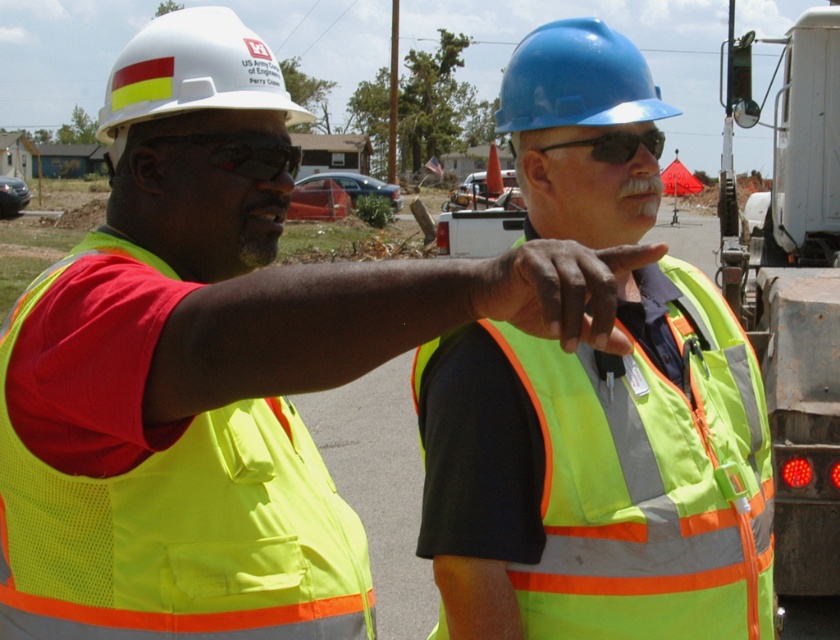
Question: Can you confirm if white matte trailer truck at right is positioned to the right of yellow reflective vest at center?

Choices:
 (A) yes
 (B) no

Answer: (A)

Question: Which object is farther from the camera taking this photo?

Choices:
 (A) white hard hat at upper left
 (B) yellow reflective vest at center
 (C) high-visibility fabric safety vest at left
 (D) white matte trailer truck at right

Answer: (D)

Question: Which of these objects is positioned farthest from the blue hard hat at upper center?

Choices:
 (A) high-visibility fabric safety vest at left
 (B) white hard hat at upper left

Answer: (B)

Question: Among these objects, which one is nearest to the camera?

Choices:
 (A) blue hard hat at upper center
 (B) matte black goggles at center
 (C) white matte trailer truck at right

Answer: (B)

Question: Does high-visibility fabric safety vest at center have a lesser width compared to matte black goggles at center?

Choices:
 (A) yes
 (B) no

Answer: (B)

Question: Is high-visibility fabric safety vest at left bigger than black plastic goggles at upper center?

Choices:
 (A) yes
 (B) no

Answer: (A)